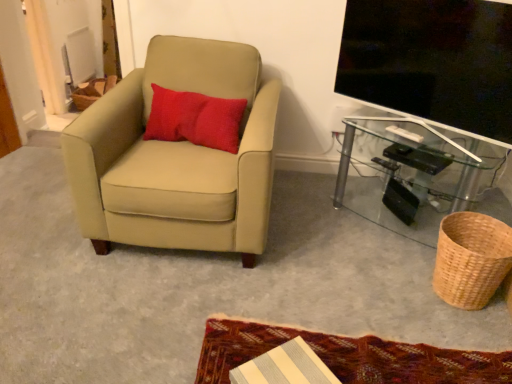
Locate an element on the screen. The image size is (512, 384). unoccupied space behind woven natural basket at lower right is located at coordinates 411,238.